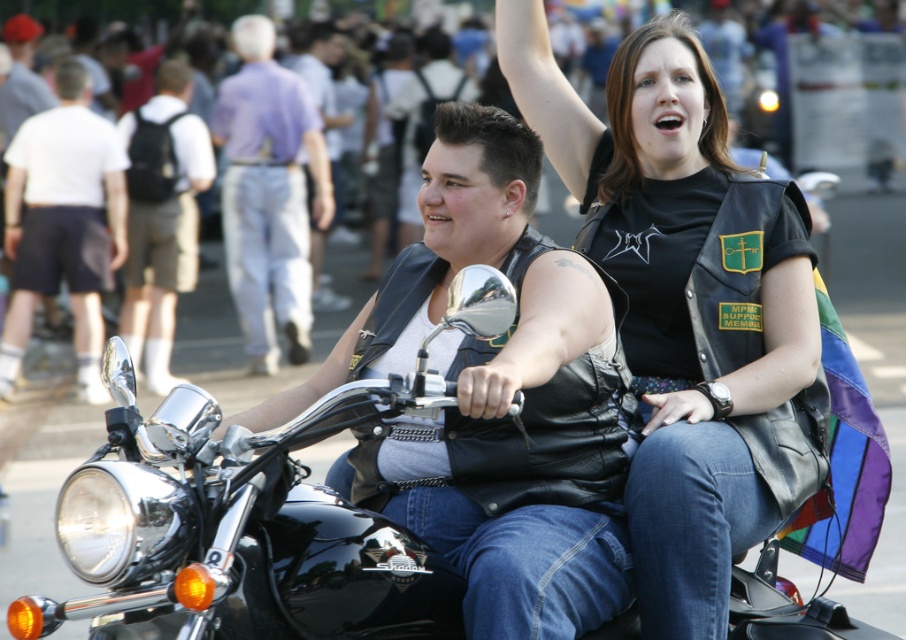
Question: Considering the real-world distances, which object is farthest from the dark brown backpack at left?

Choices:
 (A) black leather vest at upper center
 (B) white cotton shorts at left

Answer: (A)

Question: Is black leather vest at upper center positioned behind black leather motorcycle at center?

Choices:
 (A) yes
 (B) no

Answer: (A)

Question: Does white cotton shorts at left appear under dark brown backpack at left?

Choices:
 (A) yes
 (B) no

Answer: (A)

Question: Which of the following is the closest to the observer?

Choices:
 (A) black leather vest at center
 (B) black leather vest at upper center
 (C) dark brown backpack at left

Answer: (A)

Question: Is black leather vest at center to the right of light purple shirt at center from the viewer's perspective?

Choices:
 (A) yes
 (B) no

Answer: (A)

Question: Considering the real-world distances, which object is farthest from the black leather motorcycle at center?

Choices:
 (A) dark brown backpack at left
 (B) white cotton shorts at left
 (C) black leather vest at upper center
 (D) black leather vest at center

Answer: (B)